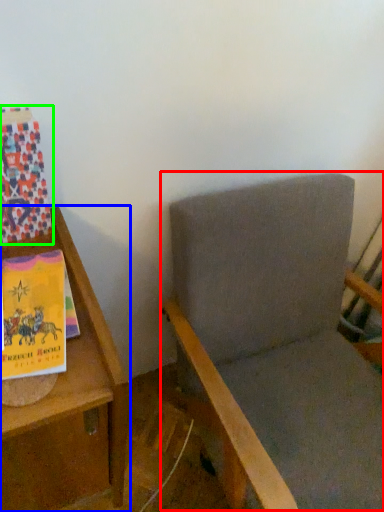
Question: Based on their relative distances, which object is nearer to rocking chair (highlighted by a red box)? Choose from furniture (highlighted by a blue box) and paperback book (highlighted by a green box).

Choices:
 (A) furniture
 (B) paperback book

Answer: (A)